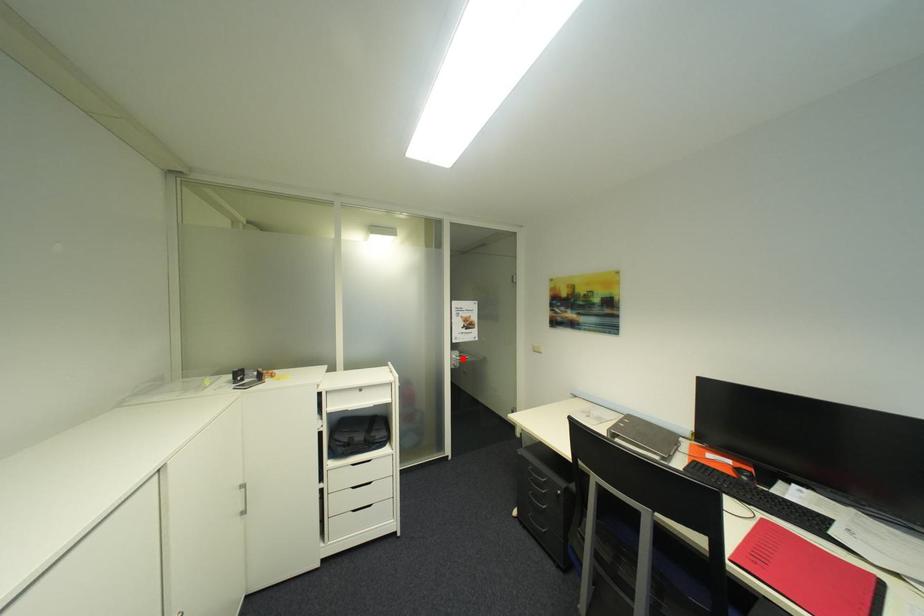
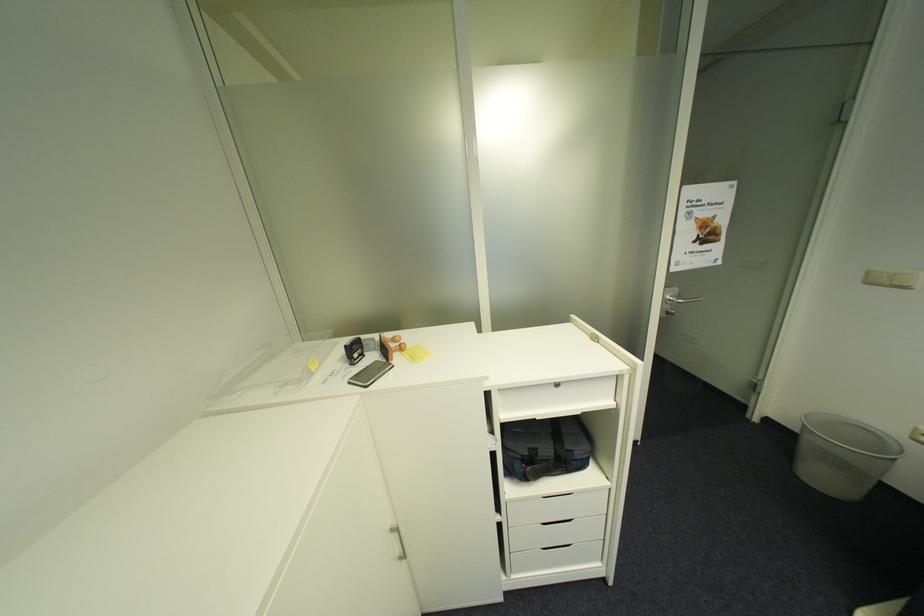
Question: I am providing you with two images of the same scene from different viewpoints. Given a red point in image1, look at the same physical point in image2. Is it:

Choices:
 (A) Closer to the viewpoint
 (B) Farther from the viewpoint

Answer: (A)